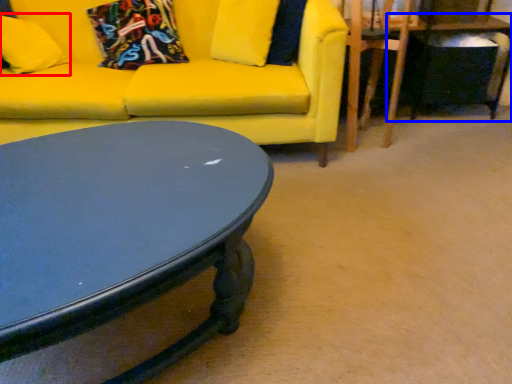
Question: Among these objects, which one is nearest to the camera, pillow (highlighted by a red box) or table (highlighted by a blue box)?

Choices:
 (A) pillow
 (B) table

Answer: (A)